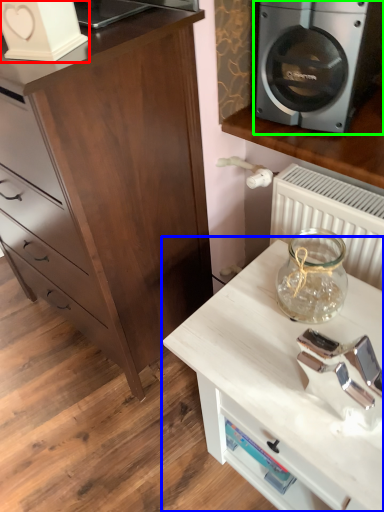
Question: Considering the real-world distances, which object is farthest from appliance (highlighted by a red box)? table (highlighted by a blue box) or home appliance (highlighted by a green box)?

Choices:
 (A) table
 (B) home appliance

Answer: (A)